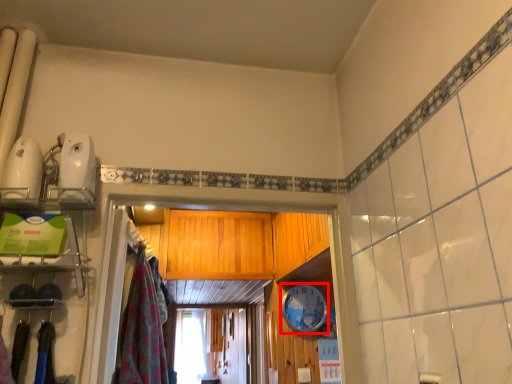
Question: Observing the image, what is the correct spatial positioning of clock (annotated by the red box) in reference to clothing?

Choices:
 (A) left
 (B) right

Answer: (B)